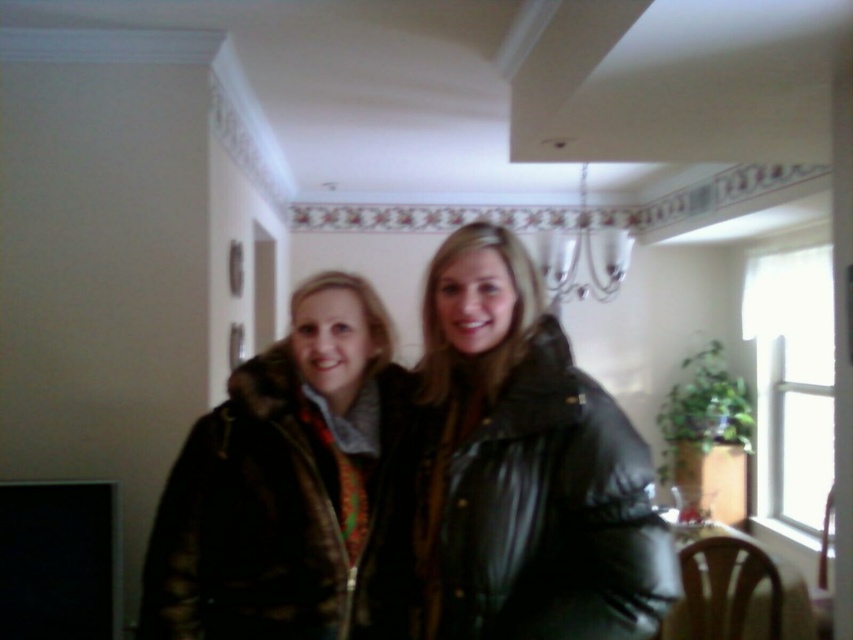
Which is more to the right, shiny black jacket at center or fur-lined coat at center?

From the viewer's perspective, shiny black jacket at center appears more on the right side.

Does shiny black jacket at center have a smaller size compared to fur-lined coat at center?

Incorrect, shiny black jacket at center is not smaller in size than fur-lined coat at center.

Measure the distance between point (511, 392) and camera.

Point (511, 392) and camera are 4.09 feet apart from each other.

In order to click on shiny black jacket at center in this screenshot , I will do `click(509, 476)`.